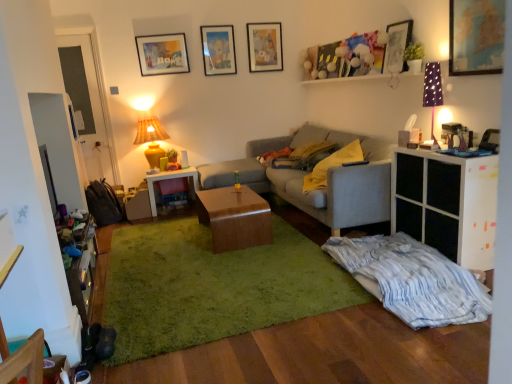
Where is `free space in front of glossy brown coffee table at center`? This screenshot has height=384, width=512. free space in front of glossy brown coffee table at center is located at coordinates (245, 260).